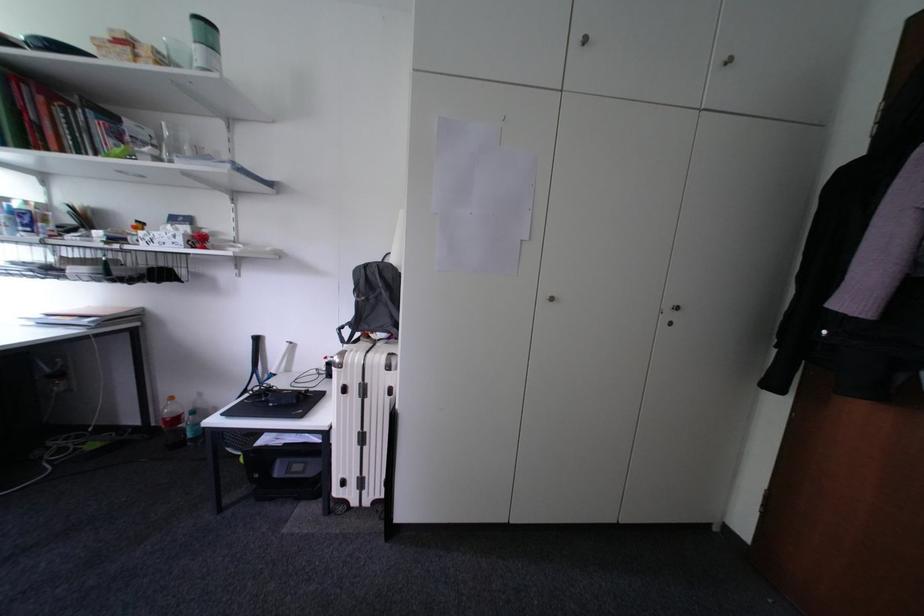
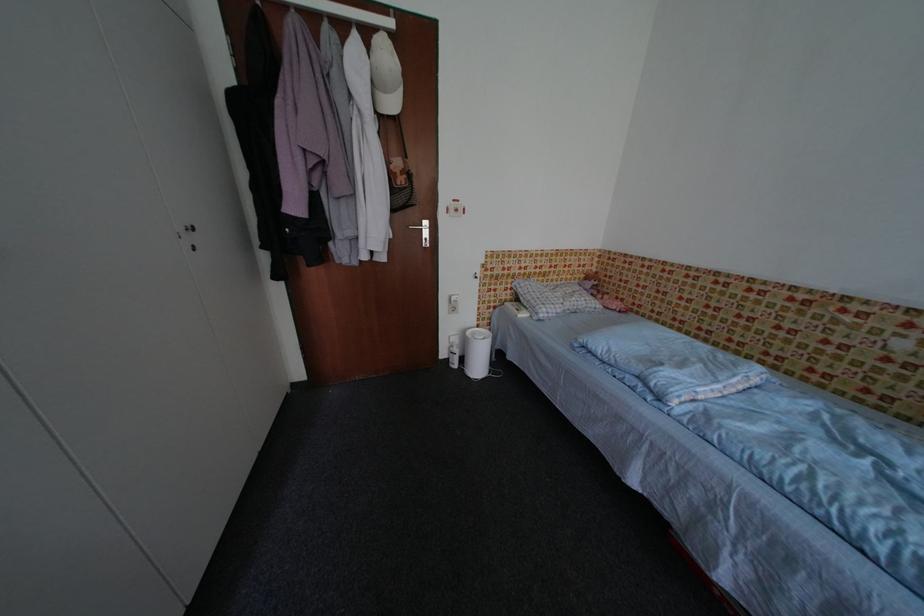
How did the camera likely rotate?

The camera rotated toward right-down.